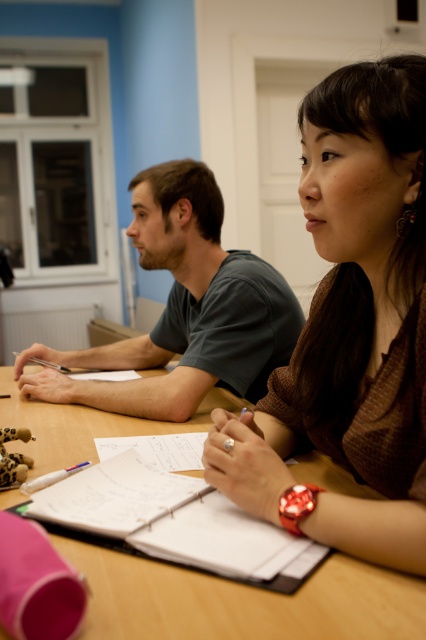
Question: Is wooden table at center above white paper notebook at center?

Choices:
 (A) no
 (B) yes

Answer: (B)

Question: Which object is positioned closest to the white paper notebook at center?

Choices:
 (A) matte brown shirt at center
 (B) wooden table at center

Answer: (B)

Question: Can you confirm if matte gray shirt at center is bigger than white paper notebook at center?

Choices:
 (A) yes
 (B) no

Answer: (A)

Question: Does matte brown shirt at center appear on the right side of wooden table at center?

Choices:
 (A) no
 (B) yes

Answer: (B)

Question: Which point is farther to the camera?

Choices:
 (A) white paper notebook at center
 (B) matte gray shirt at center
 (C) wooden table at center
 (D) matte brown shirt at center

Answer: (B)

Question: Based on their relative distances, which object is farther from the wooden table at center?

Choices:
 (A) white paper notebook at center
 (B) matte gray shirt at center
 (C) matte brown shirt at center

Answer: (B)